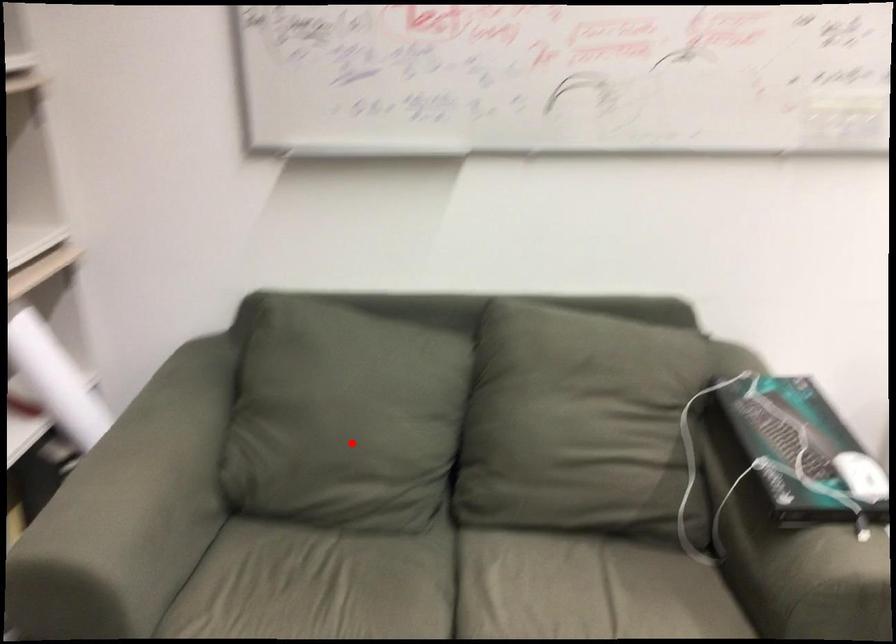
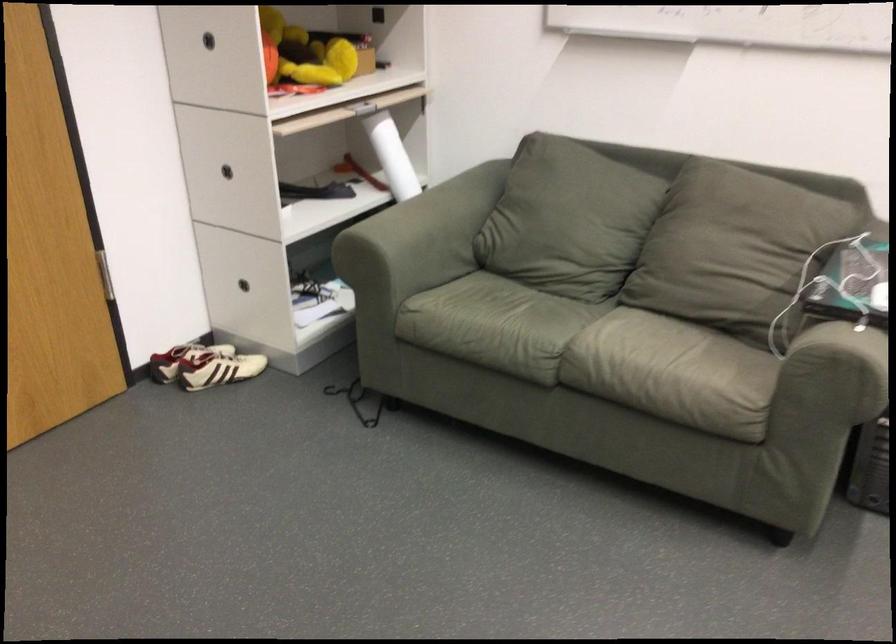
Question: A red point is marked in image1. In image2, is the corresponding 3D point closer to the camera or farther? Reply with the corresponding letter.

Choices:
 (A) The corresponding 3D point is closer.
 (B) The corresponding 3D point is farther.

Answer: (B)